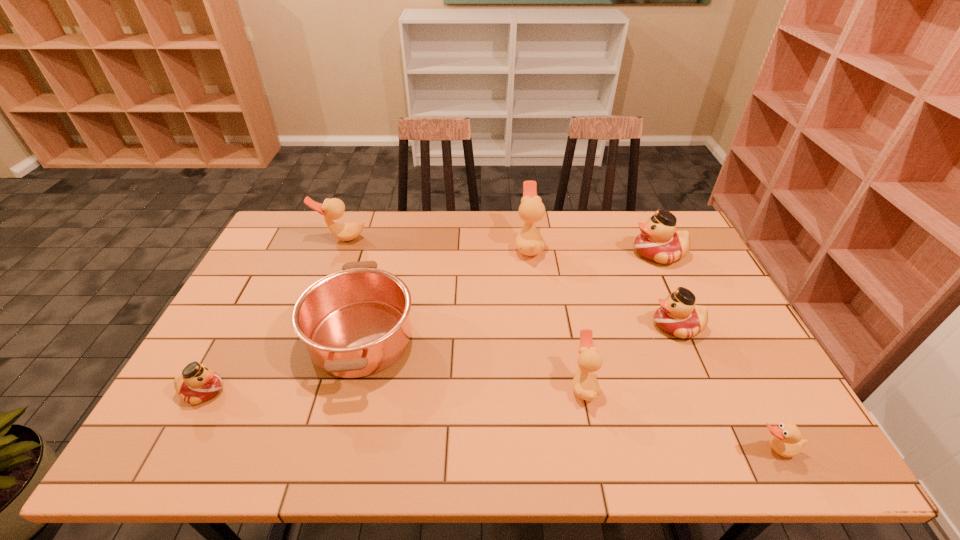
Identify which duck is the second nearest to the leftmost red duck. Please provide its 2D coordinates. Your answer should be formatted as a tuple, i.e. [(x, y)], where the tuple contains the x and y coordinates of a point satisfying the conditions above.

[(586, 386)]

Identify which tan duck is located as the third nearest to the saucepan. Please provide its 2D coordinates. Your answer should be formatted as a tuple, i.e. [(x, y)], where the tuple contains the x and y coordinates of a point satisfying the conditions above.

[(586, 386)]

Where is `tan duck that is the fourth closest one to the saucepan`? The height and width of the screenshot is (540, 960). tan duck that is the fourth closest one to the saucepan is located at coordinates (787, 441).

Point out which red duck is positioned as the second nearest to the leftmost duck. Please provide its 2D coordinates. Your answer should be formatted as a tuple, i.e. [(x, y)], where the tuple contains the x and y coordinates of a point satisfying the conditions above.

[(658, 242)]

Select which red duck appears as the third closest to the saucepan. Please provide its 2D coordinates. Your answer should be formatted as a tuple, i.e. [(x, y)], where the tuple contains the x and y coordinates of a point satisfying the conditions above.

[(658, 242)]

This screenshot has height=540, width=960. I want to click on blank space that satisfies the following two spatial constraints: 1. on the beak of the sixth duck from right to left; 2. on the left side of the saucepan, so click(x=303, y=338).